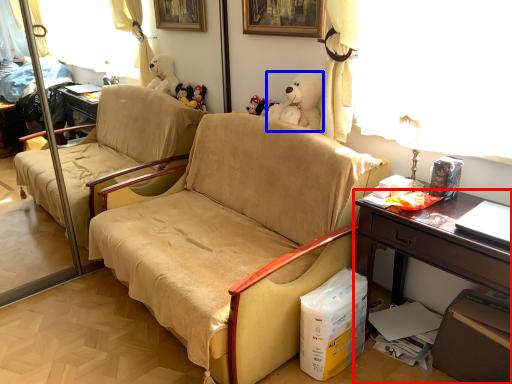
Question: Which point is closer to the camera, desk (highlighted by a red box) or toy (highlighted by a blue box)?

Choices:
 (A) desk
 (B) toy

Answer: (A)